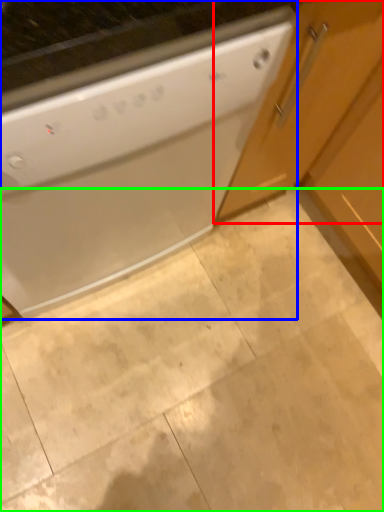
Question: Which object is the closest to the cabinetry (highlighted by a red box)? Choose among these: home appliance (highlighted by a blue box) or granite (highlighted by a green box).

Choices:
 (A) home appliance
 (B) granite

Answer: (A)